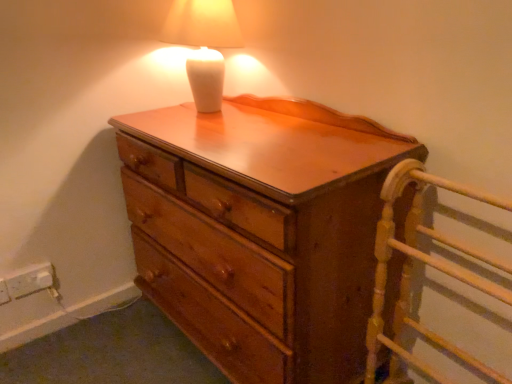
Question: From a real-world perspective, is wooden chest of drawers at center above or below white glossy lamp at upper center?

Choices:
 (A) above
 (B) below

Answer: (B)

Question: Considering the positions of point (222, 144) and point (184, 29), is point (222, 144) closer or farther from the camera than point (184, 29)?

Choices:
 (A) farther
 (B) closer

Answer: (B)

Question: Based on their relative distances, which object is nearer to the wooden bed frame at right?

Choices:
 (A) white plastic electric outlet at lower left
 (B) white glossy lamp at upper center
 (C) wooden chest of drawers at center

Answer: (C)

Question: Which of these objects is positioned closest to the white plastic electric outlet at lower left?

Choices:
 (A) wooden bed frame at right
 (B) white glossy lamp at upper center
 (C) wooden chest of drawers at center

Answer: (C)